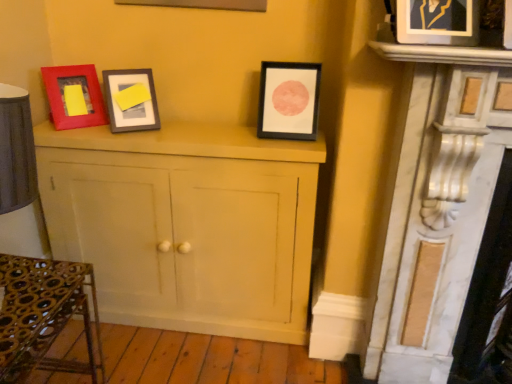
Question: Considering the positions of black matte picture frame at center, arranged as the 1th picture frame when viewed from the back, and white marble fireplace at right in the image, is black matte picture frame at center, arranged as the 1th picture frame when viewed from the back, taller or shorter than white marble fireplace at right?

Choices:
 (A) short
 (B) tall

Answer: (A)

Question: Is black matte picture frame at center, arranged as the 1th picture frame when viewed from the left, wider or thinner than white marble fireplace at right?

Choices:
 (A) wide
 (B) thin

Answer: (B)

Question: Which object is the closest to the black matte picture frame at center, the second picture frame when ordered from right to left?

Choices:
 (A) metallic wrought iron table at lower left
 (B) matte white cabinet at center
 (C) white marble fireplace at right
 (D) metallic gold picture frame at upper right, which is the 2th picture frame from left to right

Answer: (B)

Question: Which of these objects is positioned farthest from the matte white cabinet at center?

Choices:
 (A) metallic wrought iron table at lower left
 (B) metallic gold picture frame at upper right, which is the 2th picture frame from left to right
 (C) black matte picture frame at center, marked as the 2th picture frame in a front-to-back arrangement
 (D) white marble fireplace at right

Answer: (B)